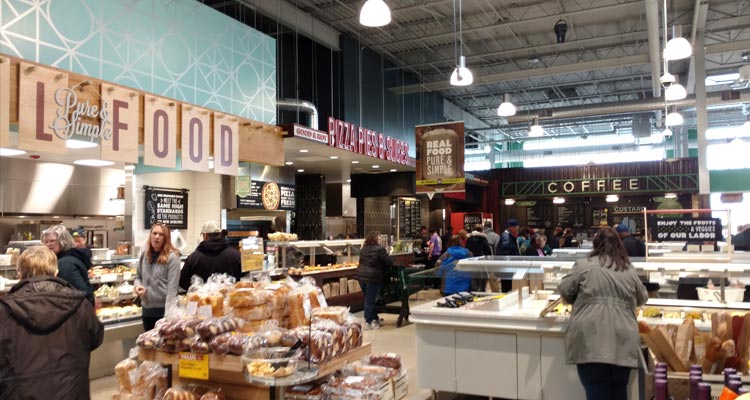
This screenshot has height=400, width=750. I want to click on square table with backed goods on display, left of center, bottom, so click(213, 293), click(244, 303), click(272, 307), click(290, 304), click(319, 300), click(344, 333), click(312, 350), click(274, 346), click(162, 330), click(66, 397).